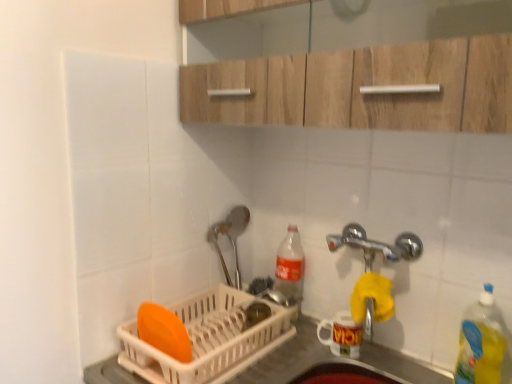
What do you see at coordinates (288, 358) in the screenshot?
I see `white plastic dish rack at lower left` at bounding box center [288, 358].

This screenshot has width=512, height=384. Describe the element at coordinates (364, 84) in the screenshot. I see `wooden cabinet at upper center` at that location.

Image resolution: width=512 pixels, height=384 pixels. In order to click on yellow translucent bottle at right, which ranks as the first bottle in front-to-back order in this screenshot , I will do `click(481, 343)`.

From a real-world perspective, is white plastic dish rack at lower left located beneath yellow translucent bottle at right, placed as the 2th bottle when sorted from back to front?

Correct, in the physical world, white plastic dish rack at lower left is lower than yellow translucent bottle at right, placed as the 2th bottle when sorted from back to front.

Is white plastic dish rack at lower left surrounding yellow translucent bottle at right, the first bottle positioned from the right?

No, yellow translucent bottle at right, the first bottle positioned from the right, is located outside of white plastic dish rack at lower left.

From the picture: Does white plastic dish rack at lower left have a smaller size compared to yellow translucent bottle at right, which ranks as the first bottle in front-to-back order?

No, white plastic dish rack at lower left is not smaller than yellow translucent bottle at right, which ranks as the first bottle in front-to-back order.

Which point is more forward, (288, 346) or (480, 120)?

The point (480, 120) is closer to the camera.

Can you confirm if white plastic dish rack at lower left is wider than wooden cabinet at upper center?

Yes, white plastic dish rack at lower left is wider than wooden cabinet at upper center.

In the scene shown: From a real-world perspective, is white plastic dish rack at lower left physically below wooden cabinet at upper center?

Correct, in the physical world, white plastic dish rack at lower left is lower than wooden cabinet at upper center.

Is white plastic dish rack at lower left positioned beyond the bounds of wooden cabinet at upper center?

That's correct, white plastic dish rack at lower left is outside of wooden cabinet at upper center.

Is yellow translucent bottle at right, the 2th bottle positioned from the left, facing away from white plastic dish rack at lower left?

No, white plastic dish rack at lower left is not at the back of yellow translucent bottle at right, the 2th bottle positioned from the left.

From the image's perspective, which one is positioned lower, yellow translucent bottle at right, which ranks as the first bottle in front-to-back order, or white plastic dish rack at lower left?

white plastic dish rack at lower left appears lower in the image.

Which object is wider, yellow translucent bottle at right, placed as the 2th bottle when sorted from back to front, or white plastic dish rack at lower left?

With larger width is white plastic dish rack at lower left.

Can you tell me how much yellow translucent bottle at right, which ranks as the first bottle in front-to-back order, and white plastic dish rack at lower left differ in facing direction?

yellow translucent bottle at right, which ranks as the first bottle in front-to-back order, and white plastic dish rack at lower left are facing 1.9 degrees away from each other.

From a real-world perspective, is translucent plastic bottle at center, placed as the second bottle when sorted from right to left, above or below yellow translucent bottle at right, placed as the 2th bottle when sorted from back to front?

Clearly, from a real-world perspective, translucent plastic bottle at center, placed as the second bottle when sorted from right to left, is above yellow translucent bottle at right, placed as the 2th bottle when sorted from back to front.

Which of these two, translucent plastic bottle at center, placed as the second bottle when sorted from right to left, or yellow translucent bottle at right, placed as the 2th bottle when sorted from back to front, stands shorter?

Standing shorter between the two is yellow translucent bottle at right, placed as the 2th bottle when sorted from back to front.

Is translucent plastic bottle at center, which ranks as the 1th bottle in back-to-front order, beside yellow translucent bottle at right, placed as the 2th bottle when sorted from back to front?

translucent plastic bottle at center, which ranks as the 1th bottle in back-to-front order, and yellow translucent bottle at right, placed as the 2th bottle when sorted from back to front, are not in contact.

Locate an element on the screen. The image size is (512, 384). bottle that is on the left side of yellow translucent bottle at right, the 2th bottle positioned from the left is located at coordinates (290, 266).

Considering the sizes of objects wooden cabinet at upper center and translucent plastic bottle at center, which ranks as the 1th bottle in back-to-front order, in the image provided, who is wider, wooden cabinet at upper center or translucent plastic bottle at center, which ranks as the 1th bottle in back-to-front order,?

wooden cabinet at upper center.

Which of these two, wooden cabinet at upper center or translucent plastic bottle at center, the 1th bottle viewed from the left, stands taller?

wooden cabinet at upper center is taller.

Which object is closer to the camera, wooden cabinet at upper center or translucent plastic bottle at center, which ranks as the 1th bottle in back-to-front order?

wooden cabinet at upper center is more forward.

Which object is positioned more to the right, wooden cabinet at upper center or translucent plastic bottle at center, the second bottle from the front?

From the viewer's perspective, wooden cabinet at upper center appears more on the right side.

From the image's perspective, does yellow translucent bottle at right, which ranks as the first bottle in front-to-back order, appear lower than translucent plastic bottle at center, the second bottle from the front?

Yes.

Considering the relative sizes of yellow translucent bottle at right, the first bottle positioned from the right, and translucent plastic bottle at center, placed as the second bottle when sorted from right to left, in the image provided, is yellow translucent bottle at right, the first bottle positioned from the right, shorter than translucent plastic bottle at center, placed as the second bottle when sorted from right to left,?

Yes.

The image size is (512, 384). Identify the location of bottle above the yellow translucent bottle at right, placed as the 2th bottle when sorted from back to front (from a real-world perspective). (290, 266).

In the image, is yellow translucent bottle at right, the 2th bottle positioned from the left, on the left side or the right side of translucent plastic bottle at center, the second bottle from the front?

In the image, yellow translucent bottle at right, the 2th bottle positioned from the left, appears on the right side of translucent plastic bottle at center, the second bottle from the front.

How much distance is there between translucent plastic bottle at center, the second bottle from the front, and wooden cabinet at upper center?

translucent plastic bottle at center, the second bottle from the front, and wooden cabinet at upper center are 22.08 inches apart.

Based on the photo, from the image's perspective, is translucent plastic bottle at center, which ranks as the 1th bottle in back-to-front order, on wooden cabinet at upper center?

No.

Is translucent plastic bottle at center, the second bottle from the front, further to the viewer compared to wooden cabinet at upper center?

Yes, translucent plastic bottle at center, the second bottle from the front, is further from the camera.

Consider the image. From a real-world perspective, is translucent plastic bottle at center, the 1th bottle viewed from the left, positioned above or below wooden cabinet at upper center?

translucent plastic bottle at center, the 1th bottle viewed from the left, is below wooden cabinet at upper center.

You are a GUI agent. You are given a task and a screenshot of the screen. Output one action in this format:
    pyautogui.click(x=<x>, y=<y>)
    Task: Click on the 2nd bottle to the right of the white plastic dish rack at lower left, counting from the anchor's position
    The width and height of the screenshot is (512, 384).
    Given the screenshot: What is the action you would take?
    pyautogui.click(x=481, y=343)

At what (x,y) coordinates should I click in order to perform the action: click on cabinetry in front of the white plastic dish rack at lower left. Please return your answer as a coordinate pair (x, y). The height and width of the screenshot is (384, 512). Looking at the image, I should click on (364, 84).

When comparing their distances from white plastic dish rack at lower left, does white plastic dish rack at lower left or wooden cabinet at upper center seem further?

The object further to white plastic dish rack at lower left is wooden cabinet at upper center.

Based on the photo, from the image, which object appears to be nearer to yellow translucent bottle at right, the first bottle positioned from the right, white plastic dish rack at lower left or wooden cabinet at upper center?

The object closer to yellow translucent bottle at right, the first bottle positioned from the right, is white plastic dish rack at lower left.

When comparing their distances from white plastic dish rack at lower left, does translucent plastic bottle at center, the 1th bottle viewed from the left, or white plastic dish rack at lower left seem closer?

white plastic dish rack at lower left lies closer to white plastic dish rack at lower left than the other object.

Estimate the real-world distances between objects in this image. Which object is closer to wooden cabinet at upper center, yellow translucent bottle at right, the 2th bottle positioned from the left, or translucent plastic bottle at center, the second bottle from the front?

translucent plastic bottle at center, the second bottle from the front, lies closer to wooden cabinet at upper center than the other object.

Which object lies further to the anchor point white plastic dish rack at lower left, wooden cabinet at upper center or yellow translucent bottle at right, the first bottle positioned from the right?

wooden cabinet at upper center.

Estimate the real-world distances between objects in this image. Which object is further from white plastic dish rack at lower left, translucent plastic bottle at center, placed as the second bottle when sorted from right to left, or yellow translucent bottle at right, the 2th bottle positioned from the left?

yellow translucent bottle at right, the 2th bottle positioned from the left, is further to white plastic dish rack at lower left.

When comparing their distances from translucent plastic bottle at center, the second bottle from the front, does white plastic dish rack at lower left or wooden cabinet at upper center seem closer?

Among the two, white plastic dish rack at lower left is located nearer to translucent plastic bottle at center, the second bottle from the front.

From the image, which object appears to be farther from white plastic dish rack at lower left, wooden cabinet at upper center or translucent plastic bottle at center, which ranks as the 1th bottle in back-to-front order?

The object further to white plastic dish rack at lower left is wooden cabinet at upper center.

At what (x,y) coordinates should I click in order to perform the action: click on basket between wooden cabinet at upper center and white plastic dish rack at lower left from top to bottom. Please return your answer as a coordinate pair (x, y). Image resolution: width=512 pixels, height=384 pixels. Looking at the image, I should click on (209, 339).

Where is `bottle between white plastic dish rack at lower left and translucent plastic bottle at center, the 1th bottle viewed from the left, in the front-back direction`? bottle between white plastic dish rack at lower left and translucent plastic bottle at center, the 1th bottle viewed from the left, in the front-back direction is located at coordinates (481, 343).

Where is `basket positioned between white plastic dish rack at lower left and translucent plastic bottle at center, the 1th bottle viewed from the left, from near to far`? basket positioned between white plastic dish rack at lower left and translucent plastic bottle at center, the 1th bottle viewed from the left, from near to far is located at coordinates (209, 339).

This screenshot has height=384, width=512. In order to click on bottle situated between white plastic dish rack at lower left and yellow translucent bottle at right, the 2th bottle positioned from the left, from left to right in this screenshot , I will do `click(290, 266)`.